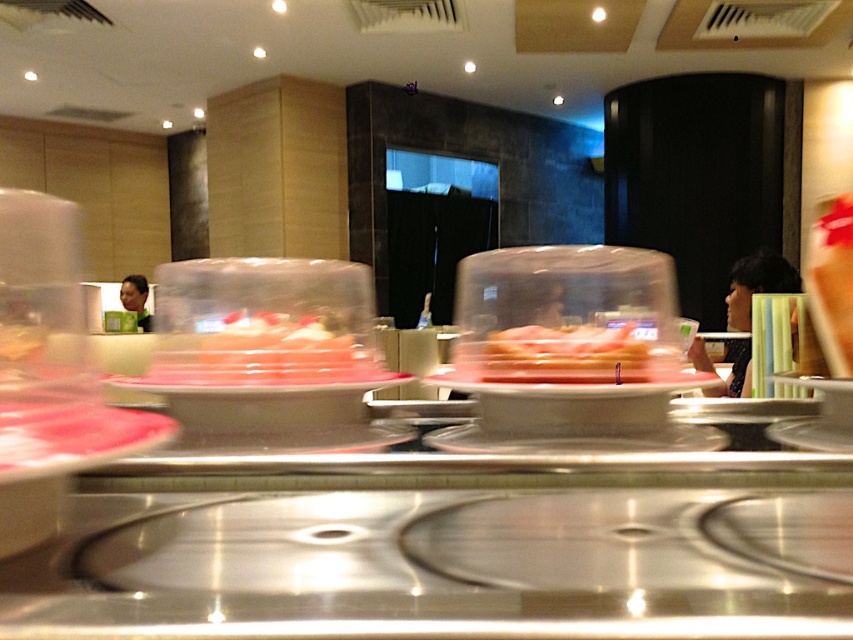
Looking at this image, you are a customer at the conveyor belt sushi restaurant. You see a pink translucent sushi at center and a pink translucent plastic at center. Which one is directly above the other?

The pink translucent plastic at center is directly above the pink translucent sushi at center because the sushi is positioned under the plastic.